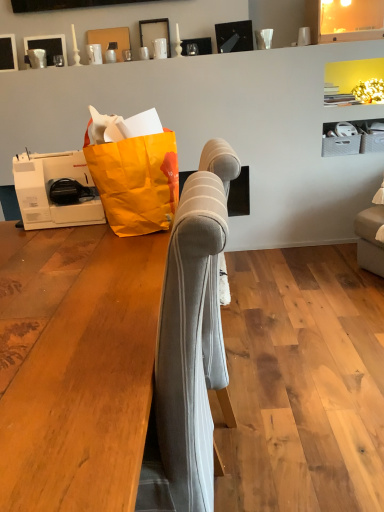
Identify the location of matte black picture frame at upper left, which is the 2th picture frame from left to right. (48, 46).

Describe the element at coordinates (48, 46) in the screenshot. I see `matte black picture frame at upper left, arranged as the second picture frame when viewed from the right` at that location.

Where is `matte black picture frame at upper left, which ranks as the 1th picture frame in left-to-right order`? matte black picture frame at upper left, which ranks as the 1th picture frame in left-to-right order is located at coordinates (8, 53).

Do you think orange paper grocery bag at left is within matte black picture frame at upper left, acting as the 3th picture frame starting from the right, or outside of it?

The correct answer is: outside.

Is orange paper grocery bag at left smaller than matte black picture frame at upper left, acting as the 3th picture frame starting from the right?

Actually, orange paper grocery bag at left might be larger than matte black picture frame at upper left, acting as the 3th picture frame starting from the right.

Which object is positioned more to the left, orange paper grocery bag at left or matte black picture frame at upper left, which ranks as the 1th picture frame in left-to-right order?

Positioned to the left is matte black picture frame at upper left, which ranks as the 1th picture frame in left-to-right order.

Considering the sizes of objects orange paper grocery bag at left and matte black picture frame at upper left, which ranks as the 1th picture frame in left-to-right order, in the image provided, who is thinner, orange paper grocery bag at left or matte black picture frame at upper left, which ranks as the 1th picture frame in left-to-right order,?

Thinner between the two is matte black picture frame at upper left, which ranks as the 1th picture frame in left-to-right order.

Is matte black picture frame at upper center, the third picture frame viewed from the left, shorter than matte black picture frame at upper left, which ranks as the 1th picture frame in left-to-right order?

Yes.

Which is correct: matte black picture frame at upper center, the third picture frame viewed from the left, is inside matte black picture frame at upper left, which ranks as the 1th picture frame in left-to-right order, or outside of it?

matte black picture frame at upper center, the third picture frame viewed from the left, lies outside matte black picture frame at upper left, which ranks as the 1th picture frame in left-to-right order.

Is matte black picture frame at upper center, the first picture frame from the right, positioned with its back to matte black picture frame at upper left, acting as the 3th picture frame starting from the right?

No, matte black picture frame at upper center, the first picture frame from the right,'s orientation is not away from matte black picture frame at upper left, acting as the 3th picture frame starting from the right.

From a real-world perspective, is orange paper grocery bag at left positioned under matte black picture frame at upper center, the first picture frame from the right, based on gravity?

Yes.

Is orange paper grocery bag at left turned away from matte black picture frame at upper center, the third picture frame viewed from the left?

Yes, matte black picture frame at upper center, the third picture frame viewed from the left, is at the back of orange paper grocery bag at left.

Can you tell me how much orange paper grocery bag at left and matte black picture frame at upper center, the first picture frame from the right, differ in facing direction?

The facing directions of orange paper grocery bag at left and matte black picture frame at upper center, the first picture frame from the right, are 170 degrees apart.

Which object is closer to the camera, matte black picture frame at upper left, which is the 2th picture frame from left to right, or orange paper grocery bag at left?

Positioned in front is orange paper grocery bag at left.

Based on the photo, is matte black picture frame at upper left, which is the 2th picture frame from left to right, taller than orange paper grocery bag at left?

In fact, matte black picture frame at upper left, which is the 2th picture frame from left to right, may be shorter than orange paper grocery bag at left.

How much distance is there between matte black picture frame at upper left, which is the 2th picture frame from left to right, and orange paper grocery bag at left?

matte black picture frame at upper left, which is the 2th picture frame from left to right, is 5.74 feet away from orange paper grocery bag at left.

Does matte black picture frame at upper left, arranged as the second picture frame when viewed from the right, touch orange paper grocery bag at left?

No, matte black picture frame at upper left, arranged as the second picture frame when viewed from the right, is not with orange paper grocery bag at left.

How far apart are matte black picture frame at upper left, arranged as the second picture frame when viewed from the right, and matte black picture frame at upper center, the third picture frame viewed from the left?

matte black picture frame at upper left, arranged as the second picture frame when viewed from the right, is 24.89 inches from matte black picture frame at upper center, the third picture frame viewed from the left.

In the image, is matte black picture frame at upper left, which is the 2th picture frame from left to right, on the left side or the right side of matte black picture frame at upper center, the first picture frame from the right?

Based on their positions, matte black picture frame at upper left, which is the 2th picture frame from left to right, is located to the left of matte black picture frame at upper center, the first picture frame from the right.

How many degrees apart are the facing directions of matte black picture frame at upper left, which is the 2th picture frame from left to right, and matte black picture frame at upper center, the first picture frame from the right?

The facing directions of matte black picture frame at upper left, which is the 2th picture frame from left to right, and matte black picture frame at upper center, the first picture frame from the right, are 0.418 degrees apart.

From the image's perspective, is matte black picture frame at upper left, arranged as the second picture frame when viewed from the right, located beneath matte black picture frame at upper center, the third picture frame viewed from the left?

Yes.

In terms of size, does matte black picture frame at upper center, the first picture frame from the right, appear bigger or smaller than orange paper grocery bag at left?

matte black picture frame at upper center, the first picture frame from the right, is smaller than orange paper grocery bag at left.

Is matte black picture frame at upper center, the third picture frame viewed from the left, aimed at orange paper grocery bag at left?

No, matte black picture frame at upper center, the third picture frame viewed from the left, is not turned towards orange paper grocery bag at left.

Locate an element on the screen. The image size is (384, 512). grocery bag in front of the matte black picture frame at upper center, the third picture frame viewed from the left is located at coordinates (133, 170).

Considering the sizes of matte black picture frame at upper center, the first picture frame from the right, and orange paper grocery bag at left in the image, is matte black picture frame at upper center, the first picture frame from the right, wider or thinner than orange paper grocery bag at left?

Clearly, matte black picture frame at upper center, the first picture frame from the right, has less width compared to orange paper grocery bag at left.

In the scene shown: From the image's perspective, is light gray fabric sofa at center beneath matte black picture frame at upper left, arranged as the second picture frame when viewed from the right?

Yes, from the image's perspective, light gray fabric sofa at center is below matte black picture frame at upper left, arranged as the second picture frame when viewed from the right.

Does light gray fabric sofa at center turn towards matte black picture frame at upper left, which is the 2th picture frame from left to right?

No, light gray fabric sofa at center is not aimed at matte black picture frame at upper left, which is the 2th picture frame from left to right.

I want to click on furniture in front of the matte black picture frame at upper left, arranged as the second picture frame when viewed from the right, so click(76, 365).

From a real-world perspective, between light gray fabric sofa at center and matte black picture frame at upper left, arranged as the second picture frame when viewed from the right, who is vertically higher?

In real-world perspective, matte black picture frame at upper left, arranged as the second picture frame when viewed from the right, is above.

The width and height of the screenshot is (384, 512). I want to click on grocery bag below the matte black picture frame at upper left, acting as the 3th picture frame starting from the right (from a real-world perspective), so click(133, 170).

Where is `picture frame located in front of the matte black picture frame at upper left, which ranks as the 1th picture frame in left-to-right order`? picture frame located in front of the matte black picture frame at upper left, which ranks as the 1th picture frame in left-to-right order is located at coordinates (154, 34).

Considering their positions, is light gray fabric sofa at center positioned closer to matte black picture frame at upper center, the third picture frame viewed from the left, than matte black picture frame at upper left, which ranks as the 1th picture frame in left-to-right order?

The object closer to matte black picture frame at upper center, the third picture frame viewed from the left, is matte black picture frame at upper left, which ranks as the 1th picture frame in left-to-right order.

Based on their spatial positions, is matte black picture frame at upper left, acting as the 3th picture frame starting from the right, or light gray fabric sofa at center closer to orange paper grocery bag at left?

Based on the image, light gray fabric sofa at center appears to be nearer to orange paper grocery bag at left.

Considering their positions, is orange paper grocery bag at left positioned closer to matte black picture frame at upper left, which ranks as the 1th picture frame in left-to-right order, than light gray fabric sofa at center?

orange paper grocery bag at left is positioned closer to the anchor matte black picture frame at upper left, which ranks as the 1th picture frame in left-to-right order.

When comparing their distances from matte black picture frame at upper center, the third picture frame viewed from the left, does matte black picture frame at upper left, arranged as the second picture frame when viewed from the right, or light gray fabric sofa at center seem further?

The object further to matte black picture frame at upper center, the third picture frame viewed from the left, is light gray fabric sofa at center.

Looking at this image, considering their positions, is matte black picture frame at upper left, arranged as the second picture frame when viewed from the right, positioned closer to matte black picture frame at upper left, acting as the 3th picture frame starting from the right, than orange paper grocery bag at left?

matte black picture frame at upper left, arranged as the second picture frame when viewed from the right, lies closer to matte black picture frame at upper left, acting as the 3th picture frame starting from the right, than the other object.

Based on their spatial positions, is matte black picture frame at upper left, acting as the 3th picture frame starting from the right, or matte black picture frame at upper center, the third picture frame viewed from the left, further from matte black picture frame at upper left, which is the 2th picture frame from left to right?

matte black picture frame at upper center, the third picture frame viewed from the left.

In the scene shown: Which object lies nearer to the anchor point matte black picture frame at upper center, the first picture frame from the right, matte black picture frame at upper left, which ranks as the 1th picture frame in left-to-right order, or orange paper grocery bag at left?

matte black picture frame at upper left, which ranks as the 1th picture frame in left-to-right order.

Looking at the image, which one is located further to orange paper grocery bag at left, matte black picture frame at upper left, which ranks as the 1th picture frame in left-to-right order, or matte black picture frame at upper center, the first picture frame from the right?

matte black picture frame at upper left, which ranks as the 1th picture frame in left-to-right order, lies further to orange paper grocery bag at left than the other object.

Image resolution: width=384 pixels, height=512 pixels. I want to click on picture frame located between matte black picture frame at upper left, acting as the 3th picture frame starting from the right, and matte black picture frame at upper center, the third picture frame viewed from the left, in the left-right direction, so click(x=48, y=46).

At what (x,y) coordinates should I click in order to perform the action: click on picture frame between light gray fabric sofa at center and matte black picture frame at upper left, which ranks as the 1th picture frame in left-to-right order, from front to back. Please return your answer as a coordinate pair (x, y). Image resolution: width=384 pixels, height=512 pixels. Looking at the image, I should click on (154, 34).

Where is `grocery bag between light gray fabric sofa at center and matte black picture frame at upper left, which ranks as the 1th picture frame in left-to-right order, in the front-back direction`? grocery bag between light gray fabric sofa at center and matte black picture frame at upper left, which ranks as the 1th picture frame in left-to-right order, in the front-back direction is located at coordinates (133, 170).

Find the location of a particular element. This screenshot has height=512, width=384. grocery bag between light gray fabric sofa at center and matte black picture frame at upper left, which is the 2th picture frame from left to right, in the front-back direction is located at coordinates (133, 170).